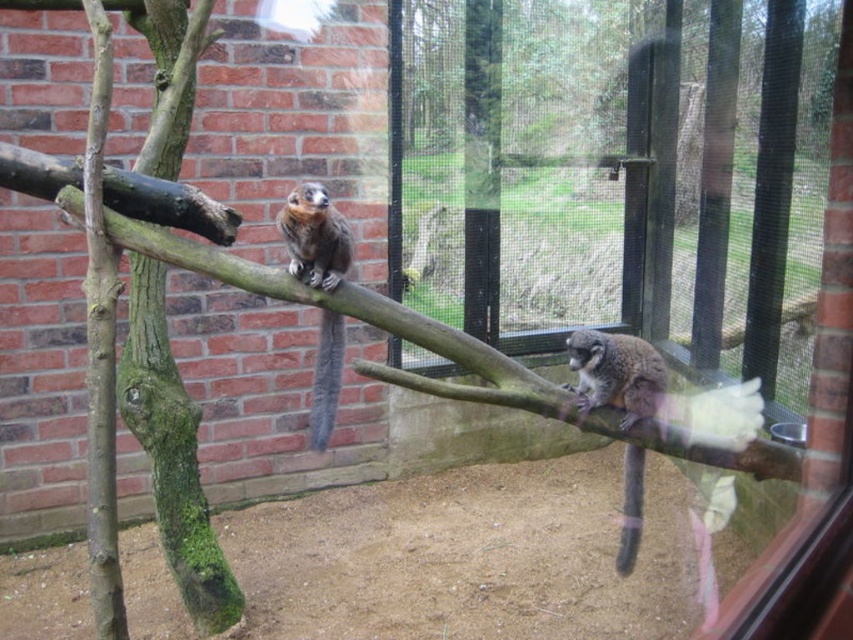
You are a zookeeper observing the lemur enclosure. There is a brown textured branch at upper center represented by point (x=389, y=324). Where is the brown textured branch at upper center located in the enclosure?

The brown textured branch at upper center is located at the point (x=389, y=324) in the enclosure.

You are standing in front of the zoo enclosure and want to reach a point that is exactly at coordinates point [213,227]. If your current distance to the enclosure is 1.92 meters, can you estimate how far you need to move forward to reach that point?

The point [213,227] is 1.92 meters away from the viewer, so you need to move forward 1.92 meters to reach it.

You are a zookeeper trying to place a feeding tray in the zoo enclosure. The feeding tray must be placed exactly at the position of the brown textured branch at upper center. According to the coordinates provided, where should you place the feeding tray?

The feeding tray should be placed at the coordinates point [389,324], which is the exact position of the brown textured branch at upper center.